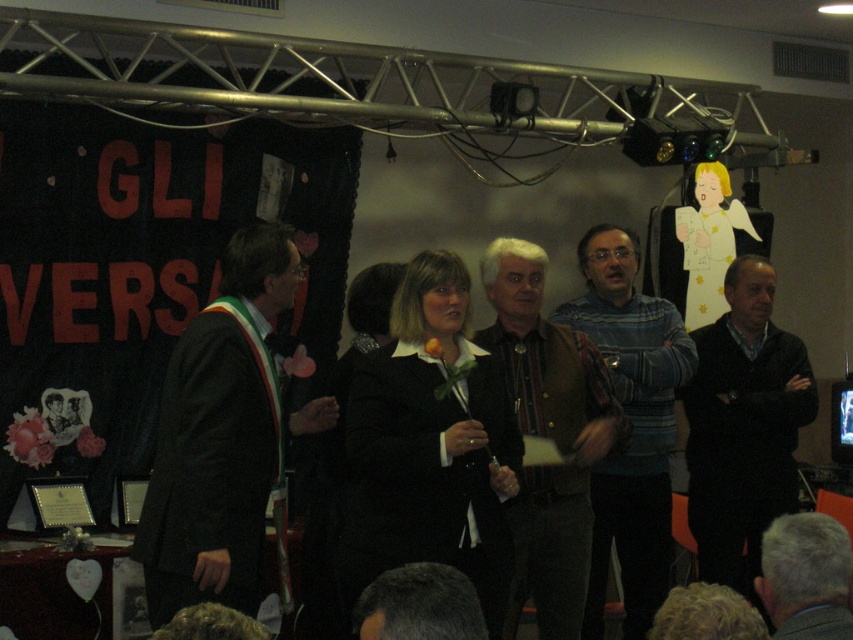
Describe the element at coordinates (430, 444) in the screenshot. I see `black matte suit at center` at that location.

Between point (424, 417) and point (653, 396), which one is positioned in front?

Point (424, 417) is more forward.

You are a GUI agent. You are given a task and a screenshot of the screen. Output one action in this format:
    pyautogui.click(x=<x>, y=<y>)
    Task: Click on the black matte suit at center
    This screenshot has width=853, height=640.
    Given the screenshot: What is the action you would take?
    pyautogui.click(x=430, y=444)

Which of these two, dark suit at left or dark brown hair at lower center, stands shorter?

dark brown hair at lower center

Who is more distant from viewer, (175, 548) or (419, 593)?

Point (175, 548)

Based on the photo, who is more forward, (146, 566) or (466, 595)?

Point (466, 595) is in front.

I want to click on dark suit at left, so (x=222, y=435).

Does black sweater at right have a greater height compared to striped sweater at center?

No.

At what (x,y) coordinates should I click in order to perform the action: click on black sweater at right. Please return your answer as a coordinate pair (x, y). Image resolution: width=853 pixels, height=640 pixels. Looking at the image, I should click on (743, 426).